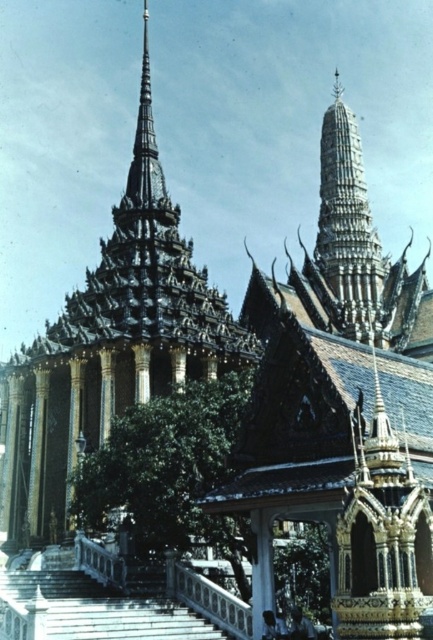
Question: Which point appears farthest from the camera in this image?

Choices:
 (A) (356, 202)
 (B) (122, 387)

Answer: (A)

Question: Observing the image, what is the correct spatial positioning of shiny gold spire at center in reference to silver metallic spire at center?

Choices:
 (A) below
 (B) above

Answer: (B)

Question: Can you confirm if shiny gold spire at center is positioned above silver metallic spire at center?

Choices:
 (A) no
 (B) yes

Answer: (B)

Question: Does shiny gold spire at center appear under silver metallic spire at center?

Choices:
 (A) yes
 (B) no

Answer: (B)

Question: Which object appears farthest from the camera in this image?

Choices:
 (A) shiny gold spire at center
 (B) silver metallic spire at center

Answer: (B)